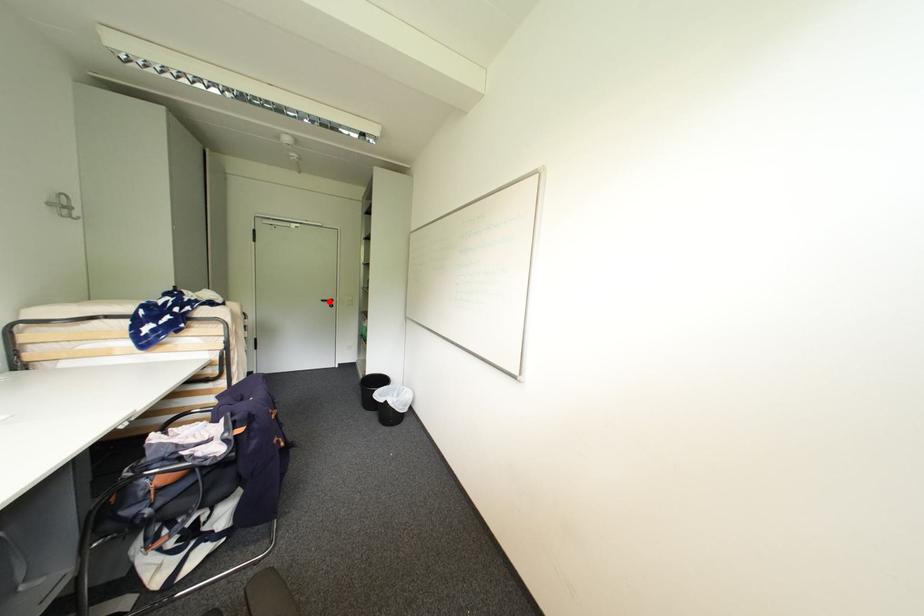
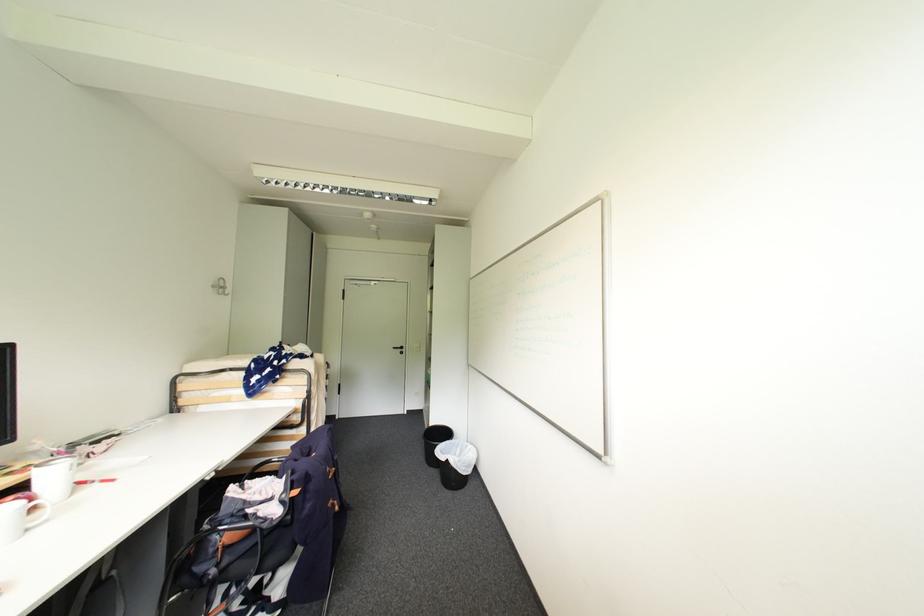
The point at the highlighted location is marked in the first image. Where is the corresponding point in the second image?

(400, 349)